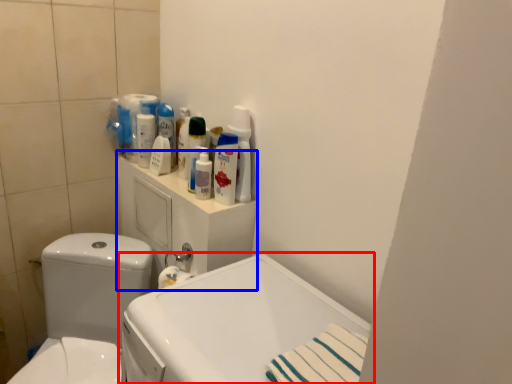
Question: Which point is closer to the camera, sink (highlighted by a red box) or medicine cabinet (highlighted by a blue box)?

Choices:
 (A) sink
 (B) medicine cabinet

Answer: (A)